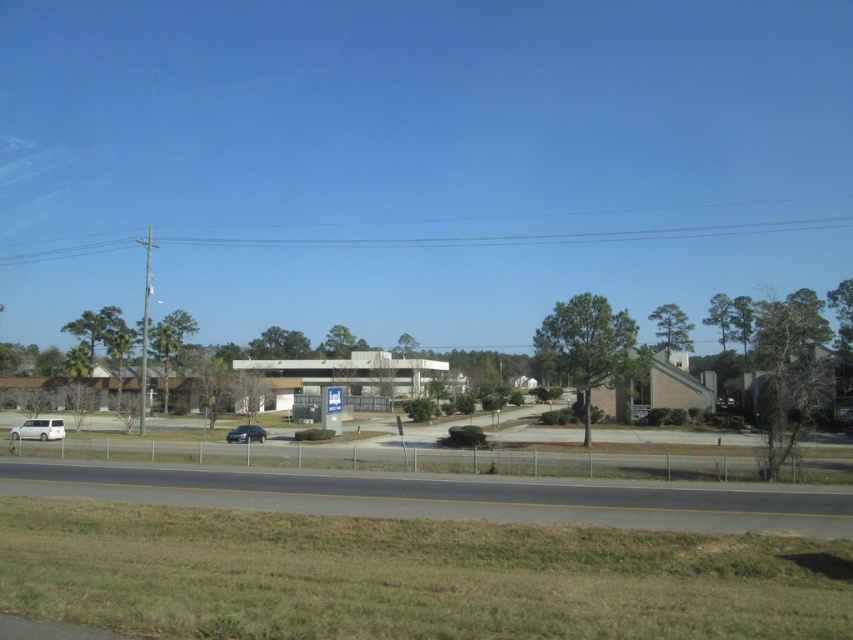
Question: Which object is closer to the camera taking this photo?

Choices:
 (A) satin black sedan at lower left
 (B) white matte van at lower left

Answer: (B)

Question: Which of the following is the farthest from the observer?

Choices:
 (A) (231, 435)
 (B) (21, 433)

Answer: (A)

Question: Does white matte van at lower left lie behind satin black sedan at lower left?

Choices:
 (A) no
 (B) yes

Answer: (A)

Question: Is white matte van at lower left to the right of satin black sedan at lower left from the viewer's perspective?

Choices:
 (A) yes
 (B) no

Answer: (B)

Question: Can you confirm if white matte van at lower left is smaller than satin black sedan at lower left?

Choices:
 (A) no
 (B) yes

Answer: (A)